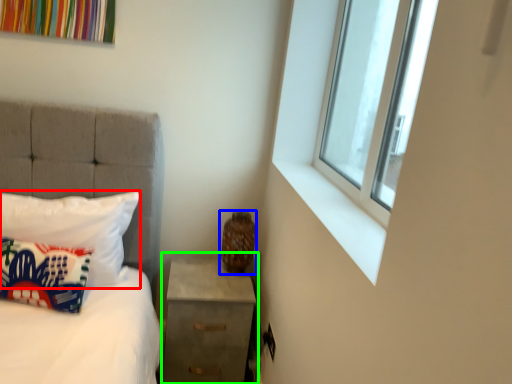
Question: Considering the real-world distances, which object is farthest from pillow (highlighted by a red box)? vase (highlighted by a blue box) or nightstand (highlighted by a green box)?

Choices:
 (A) vase
 (B) nightstand

Answer: (A)